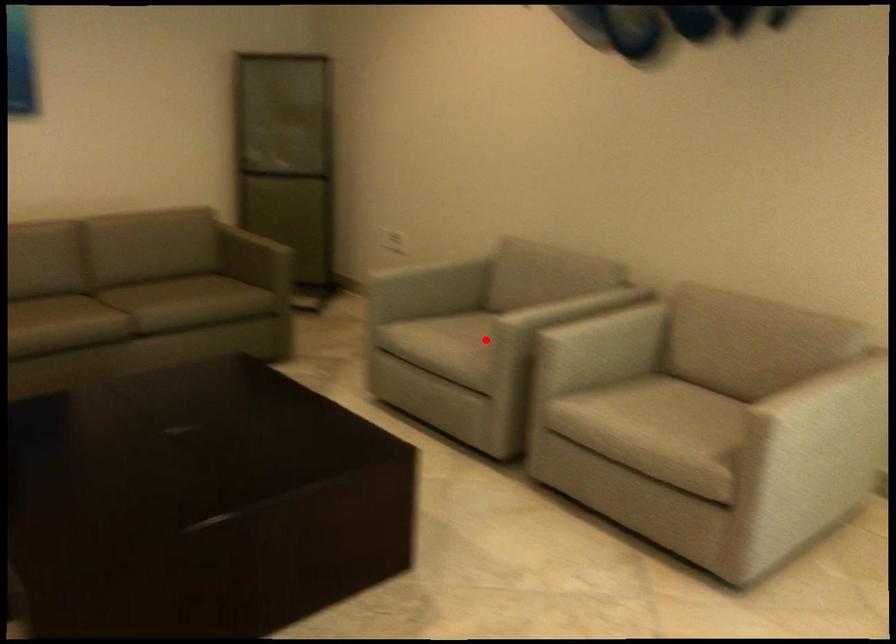
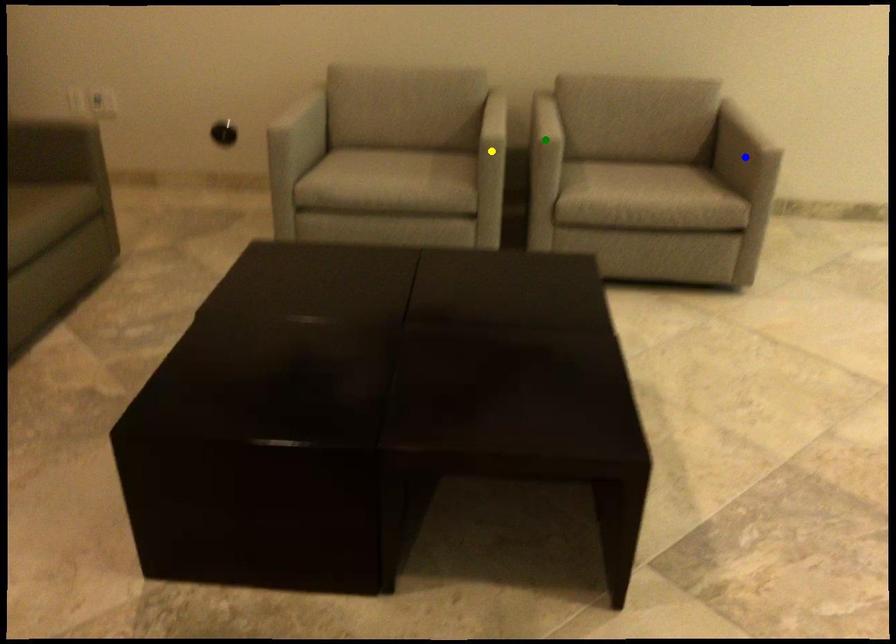
Question: I am providing you with two images of the same scene from different viewpoints. A red point is marked on the first image. You are given multiple points on the second image. Can you choose the point in image 2 that corresponds to the point in image 1?

Choices:
 (A) yellow point
 (B) green point
 (C) blue point

Answer: (A)